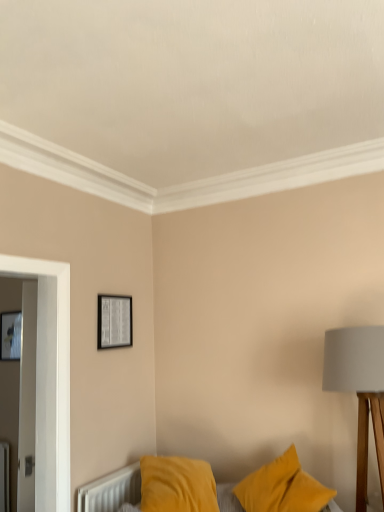
Identify the location of matte black picture frame at upper left, which is counted as the 2th picture frame, starting from the front. The height and width of the screenshot is (512, 384). (10, 336).

What is the approximate width of matte gray fabric lampshade at right?

It is 17.57 inches.

Measure the distance between matte gray fabric lampshade at right and camera.

The distance of matte gray fabric lampshade at right from camera is 1.97 meters.

The width and height of the screenshot is (384, 512). I want to click on velvet yellow pillows at lower center, so click(111, 490).

Which object is further away from the camera, velvet yellow pillows at lower center or matte black picture frame at upper left, which is counted as the 2th picture frame, starting from the front?

matte black picture frame at upper left, which is counted as the 2th picture frame, starting from the front, is further away from the camera.

Does velvet yellow pillows at lower center have a smaller size compared to matte black picture frame at upper left, the 1th picture frame from the left?

Incorrect, velvet yellow pillows at lower center is not smaller in size than matte black picture frame at upper left, the 1th picture frame from the left.

From a real-world perspective, is velvet yellow pillows at lower center above or below matte black picture frame at upper left, the first picture frame when ordered from back to front?

Clearly, from a real-world perspective, velvet yellow pillows at lower center is below matte black picture frame at upper left, the first picture frame when ordered from back to front.

Consider the image. Would you say velvet yellow pillows at lower center is inside or outside matte black picture frame at upper left, the 2th picture frame viewed from the right?

velvet yellow pillows at lower center is not enclosed by matte black picture frame at upper left, the 2th picture frame viewed from the right.

Is velvet yellow pillows at lower center oriented away from matte gray fabric lampshade at right?

No, matte gray fabric lampshade at right is not at the back of velvet yellow pillows at lower center.

Find the location of a particular element. table lamp on the right of velvet yellow pillows at lower center is located at coordinates (359, 390).

Is velvet yellow pillows at lower center in front of matte gray fabric lampshade at right?

Yes, velvet yellow pillows at lower center is closer to the viewer.

Where is `table lamp located on the right of matte black picture frame at upper center, the second picture frame viewed from the back`? table lamp located on the right of matte black picture frame at upper center, the second picture frame viewed from the back is located at coordinates (359, 390).

Based on their sizes in the image, would you say matte black picture frame at upper center, which is counted as the 2th picture frame, starting from the left, is bigger or smaller than matte gray fabric lampshade at right?

In the image, matte black picture frame at upper center, which is counted as the 2th picture frame, starting from the left, appears to be smaller than matte gray fabric lampshade at right.

Does matte black picture frame at upper center, arranged as the 1th picture frame when viewed from the front, have a greater width compared to matte gray fabric lampshade at right?

In fact, matte black picture frame at upper center, arranged as the 1th picture frame when viewed from the front, might be narrower than matte gray fabric lampshade at right.

Looking at this image, is matte black picture frame at upper left, which is counted as the 2th picture frame, starting from the front, surrounding velvet yellow pillows at lower center?

No.

Could you tell me if matte black picture frame at upper left, the 2th picture frame viewed from the right, is turned towards velvet yellow pillows at lower center?

No.

Is point (9, 339) closer or farther from the camera than point (231, 507)?

Point (9, 339) appears to be farther away from the viewer than point (231, 507).

Which point is more distant from viewer, (354,335) or (86,493)?

The point (86,493) is farther from the camera.

Are matte gray fabric lampshade at right and velvet yellow pillows at lower center beside each other?

matte gray fabric lampshade at right and velvet yellow pillows at lower center are not in contact.

At what (x,y) coordinates should I click in order to perform the action: click on bed lying below the matte gray fabric lampshade at right (from the image's perspective). Please return your answer as a coordinate pair (x, y). This screenshot has height=512, width=384. Looking at the image, I should click on (111, 490).

Can you confirm if matte gray fabric lampshade at right is bigger than velvet yellow pillows at lower center?

Actually, matte gray fabric lampshade at right might be smaller than velvet yellow pillows at lower center.

Is point (13, 356) more distant than point (380, 472)?

Yes, point (13, 356) is farther from viewer.

Looking at their sizes, would you say matte black picture frame at upper left, which is counted as the 2th picture frame, starting from the front, is wider or thinner than matte gray fabric lampshade at right?

Clearly, matte black picture frame at upper left, which is counted as the 2th picture frame, starting from the front, has less width compared to matte gray fabric lampshade at right.

Is matte black picture frame at upper left, the 2th picture frame viewed from the right, far away from matte gray fabric lampshade at right?

matte black picture frame at upper left, the 2th picture frame viewed from the right, is positioned a significant distance from matte gray fabric lampshade at right.

Identify the location of bed in front of the matte black picture frame at upper center, arranged as the 1th picture frame when viewed from the front. pos(111,490).

Is velvet yellow pillows at lower center to the right of matte black picture frame at upper center, arranged as the 1th picture frame when viewed from the front, from the viewer's perspective?

Yes.

Looking at this image, is velvet yellow pillows at lower center turned away from matte black picture frame at upper center, the second picture frame viewed from the back?

That's not correct — velvet yellow pillows at lower center is not looking away from matte black picture frame at upper center, the second picture frame viewed from the back.

Find the location of `bed below the matte black picture frame at upper left, which is counted as the 2th picture frame, starting from the front (from the image's perspective)`. bed below the matte black picture frame at upper left, which is counted as the 2th picture frame, starting from the front (from the image's perspective) is located at coordinates (111, 490).

Image resolution: width=384 pixels, height=512 pixels. There is a velvet yellow pillows at lower center. What are the coordinates of `table lamp above it (from a real-world perspective)` in the screenshot? It's located at (359, 390).

Based on their spatial positions, is matte gray fabric lampshade at right or matte black picture frame at upper left, the 2th picture frame viewed from the right, closer to velvet yellow pillows at lower center?

matte gray fabric lampshade at right is closer to velvet yellow pillows at lower center.

Estimate the real-world distances between objects in this image. Which object is further from matte black picture frame at upper center, which is counted as the 2th picture frame, starting from the left, velvet yellow pillows at lower center or matte gray fabric lampshade at right?

Among the two, matte gray fabric lampshade at right is located further to matte black picture frame at upper center, which is counted as the 2th picture frame, starting from the left.

Looking at the image, which one is located closer to matte black picture frame at upper center, the first picture frame positioned from the right, velvet yellow pillows at lower center or matte black picture frame at upper left, the first picture frame when ordered from back to front?

Based on the image, velvet yellow pillows at lower center appears to be nearer to matte black picture frame at upper center, the first picture frame positioned from the right.

Based on their spatial positions, is matte gray fabric lampshade at right or velvet yellow pillows at lower center closer to matte black picture frame at upper left, which is counted as the 2th picture frame, starting from the front?

velvet yellow pillows at lower center is positioned closer to the anchor matte black picture frame at upper left, which is counted as the 2th picture frame, starting from the front.

Which object lies further to the anchor point matte black picture frame at upper center, the first picture frame positioned from the right, matte black picture frame at upper left, which is counted as the 2th picture frame, starting from the front, or matte gray fabric lampshade at right?

matte black picture frame at upper left, which is counted as the 2th picture frame, starting from the front.

Estimate the real-world distances between objects in this image. Which object is closer to velvet yellow pillows at lower center, matte black picture frame at upper center, the second picture frame viewed from the back, or matte gray fabric lampshade at right?

matte black picture frame at upper center, the second picture frame viewed from the back, is positioned closer to the anchor velvet yellow pillows at lower center.

Based on their spatial positions, is matte gray fabric lampshade at right or velvet yellow pillows at lower center closer to matte black picture frame at upper center, which is counted as the 2th picture frame, starting from the left?

velvet yellow pillows at lower center is positioned closer to the anchor matte black picture frame at upper center, which is counted as the 2th picture frame, starting from the left.

From the image, which object appears to be nearer to matte gray fabric lampshade at right, matte black picture frame at upper left, which is counted as the 2th picture frame, starting from the front, or matte black picture frame at upper center, the first picture frame positioned from the right?

matte black picture frame at upper center, the first picture frame positioned from the right.

Image resolution: width=384 pixels, height=512 pixels. I want to click on picture frame between velvet yellow pillows at lower center and matte black picture frame at upper left, which is counted as the 2th picture frame, starting from the front, in the front-back direction, so click(x=114, y=321).

Where is `table lamp between velvet yellow pillows at lower center and matte black picture frame at upper left, the 1th picture frame from the left, in the front-back direction`? This screenshot has width=384, height=512. table lamp between velvet yellow pillows at lower center and matte black picture frame at upper left, the 1th picture frame from the left, in the front-back direction is located at coordinates (359, 390).

This screenshot has height=512, width=384. Identify the location of table lamp positioned between velvet yellow pillows at lower center and matte black picture frame at upper center, arranged as the 1th picture frame when viewed from the front, from near to far. (359, 390).

At what (x,y) coordinates should I click in order to perform the action: click on picture frame situated between matte black picture frame at upper left, the 1th picture frame from the left, and matte gray fabric lampshade at right from left to right. Please return your answer as a coordinate pair (x, y). Looking at the image, I should click on (114, 321).